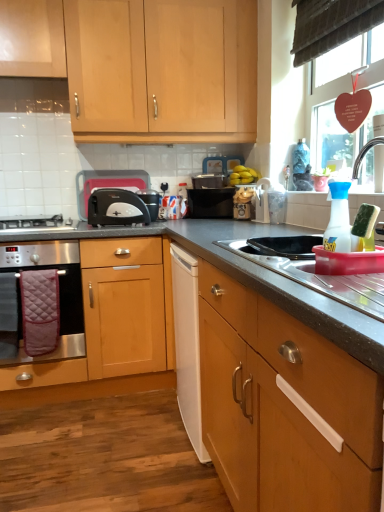
I want to click on empty space that is ontop of black matte microwave at center, which ranks as the 1th appliance in back-to-front order (from a real-world perspective), so click(213, 182).